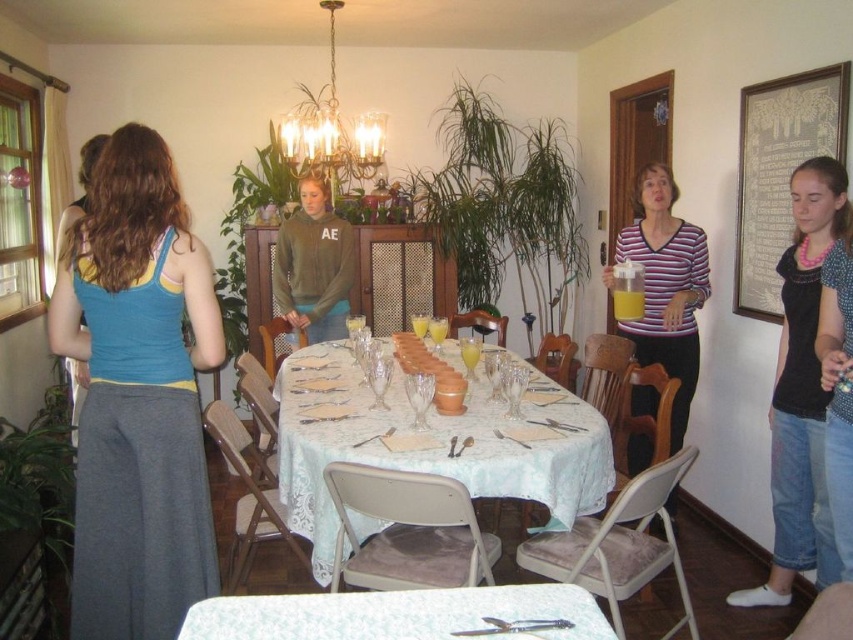
Does pink beaded necklace at upper right lie in front of gold metallic chandelier at upper center?

Yes.

Is pink beaded necklace at upper right to the right of gold metallic chandelier at upper center from the viewer's perspective?

Yes, pink beaded necklace at upper right is to the right of gold metallic chandelier at upper center.

At what (x,y) coordinates should I click in order to perform the action: click on pink beaded necklace at upper right. Please return your answer as a coordinate pair (x, y). Looking at the image, I should click on (801, 392).

I want to click on white floral tablecloth at center, so click(399, 614).

Does white floral tablecloth at center have a lesser height compared to striped cotton shirt at center?

Correct, white floral tablecloth at center is not as tall as striped cotton shirt at center.

What do you see at coordinates (399, 614) in the screenshot?
I see `white floral tablecloth at center` at bounding box center [399, 614].

This screenshot has height=640, width=853. In order to click on white floral tablecloth at center in this screenshot , I will do `click(399, 614)`.

Who is lower down, white lace tablecloth at center or gold metallic chandelier at upper center?

white lace tablecloth at center is lower down.

Based on the photo, can you confirm if white lace tablecloth at center is wider than gold metallic chandelier at upper center?

Yes.

Identify the location of white lace tablecloth at center. Image resolution: width=853 pixels, height=640 pixels. (432, 444).

Find the location of `white lace tablecloth at center`. white lace tablecloth at center is located at coordinates (432, 444).